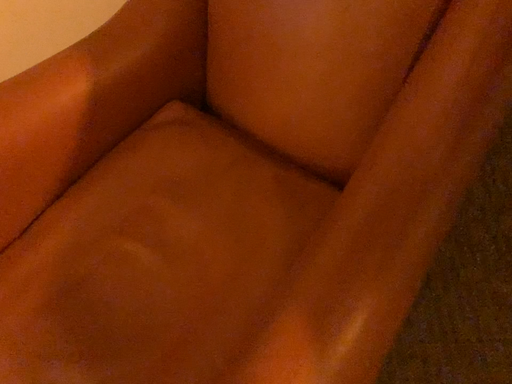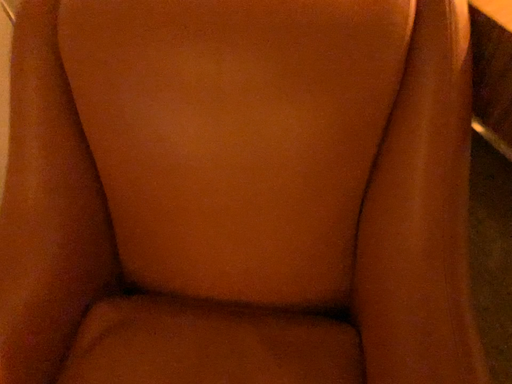
Question: Which way did the camera rotate in the video?

Choices:
 (A) rotated right
 (B) rotated left

Answer: (A)